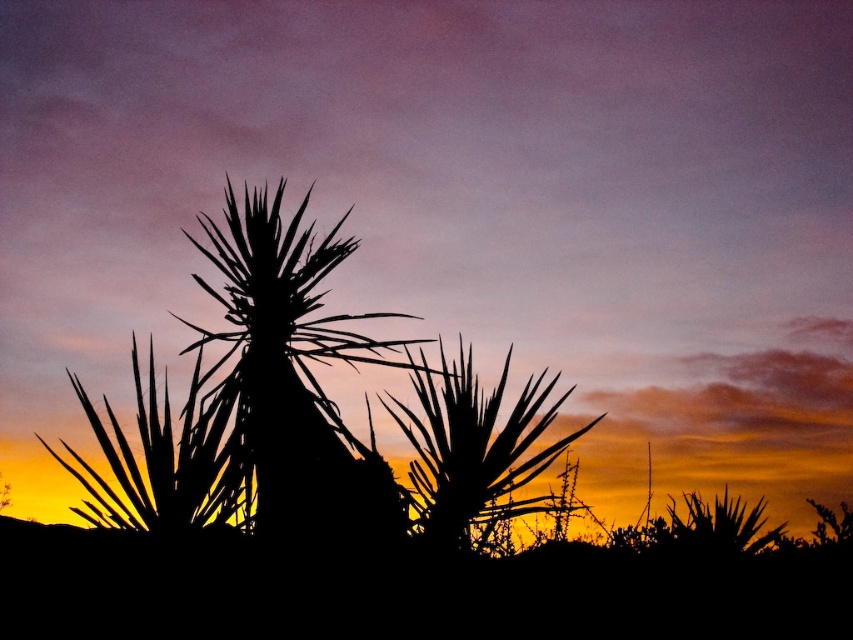
Question: Among these objects, which one is farthest from the camera?

Choices:
 (A) black spiky plant at center
 (B) silhouette leafy plant at center

Answer: (B)

Question: Which point is closer to the camera?

Choices:
 (A) black spiky plant at center
 (B) silhouette leafy plant at center

Answer: (A)

Question: Where is black spiky plant at center located in relation to silhouette leafy plant at center in the image?

Choices:
 (A) right
 (B) left

Answer: (B)

Question: Is black spiky plant at center in front of silhouette leafy plant at center?

Choices:
 (A) no
 (B) yes

Answer: (B)

Question: Does black spiky plant at center have a lesser width compared to silhouette leafy plant at center?

Choices:
 (A) no
 (B) yes

Answer: (A)